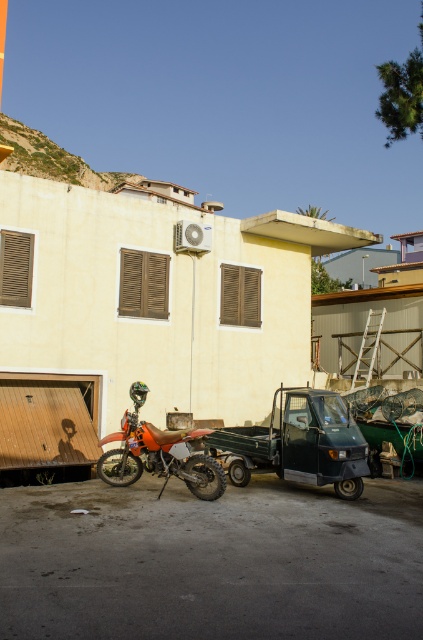
Does green matte pickup truck at center appear on the left side of orange matte dirt bike at center?

In fact, green matte pickup truck at center is to the right of orange matte dirt bike at center.

Is point (285, 458) positioned behind point (197, 474)?

That is True.

The width and height of the screenshot is (423, 640). Identify the location of green matte pickup truck at center. (299, 444).